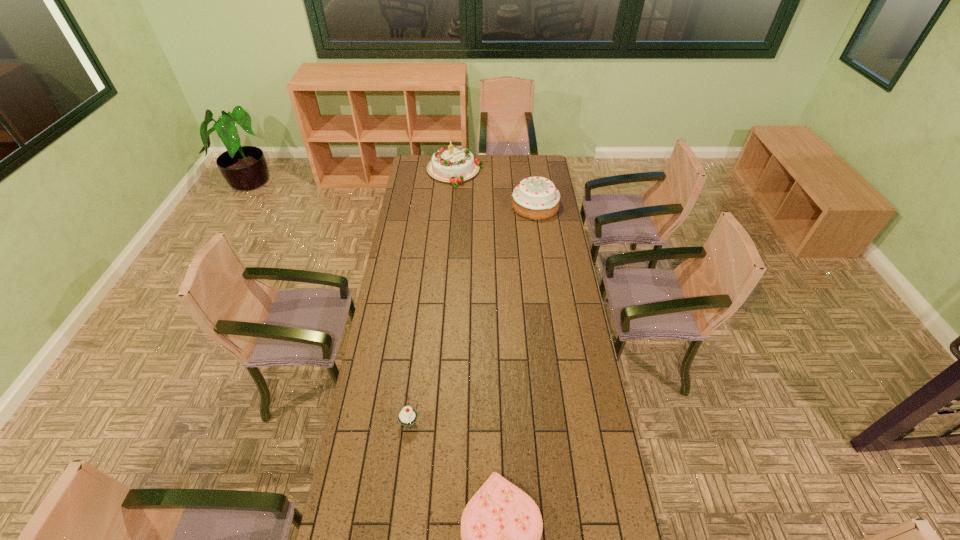
Identify which object is located as the nearest to the third nearest object. Please provide its 2D coordinates. Your answer should be formatted as a tuple, i.e. [(x, y)], where the tuple contains the x and y coordinates of a point satisfying the conditions above.

[(455, 164)]

Where is `object that stands as the second closest to the third nearest object`? The image size is (960, 540). object that stands as the second closest to the third nearest object is located at coordinates (407, 416).

Select which cake appears as the closest to the second nearest cake. Please provide its 2D coordinates. Your answer should be formatted as a tuple, i.e. [(x, y)], where the tuple contains the x and y coordinates of a point satisfying the conditions above.

[(455, 164)]

Identify which cake is the second closest to the farthest cake. Please provide its 2D coordinates. Your answer should be formatted as a tuple, i.e. [(x, y)], where the tuple contains the x and y coordinates of a point satisfying the conditions above.

[(501, 526)]

Find the location of a particular element. The image size is (960, 540). free region that satisfies the following two spatial constraints: 1. on the back side of the farthest cake; 2. on the left side of the cupcake is located at coordinates (439, 172).

Image resolution: width=960 pixels, height=540 pixels. I want to click on vacant point that satisfies the following two spatial constraints: 1. on the back side of the third farthest object; 2. on the left side of the second farthest object, so click(435, 206).

This screenshot has height=540, width=960. In order to click on vacant point that satisfies the following two spatial constraints: 1. on the front side of the second nearest cake; 2. on the left side of the farthest cake in this screenshot , I will do `click(452, 206)`.